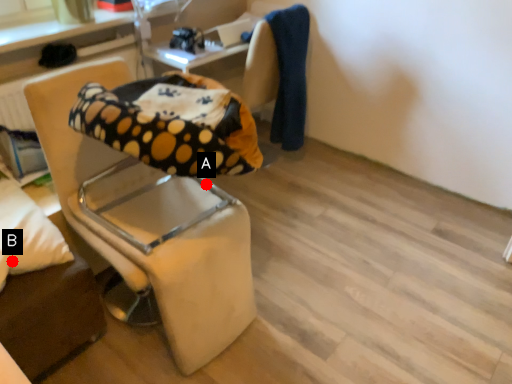
Question: Two points are circled on the image, labeled by A and B beside each circle. Which point is closer to the camera?

Choices:
 (A) A is closer
 (B) B is closer

Answer: (B)